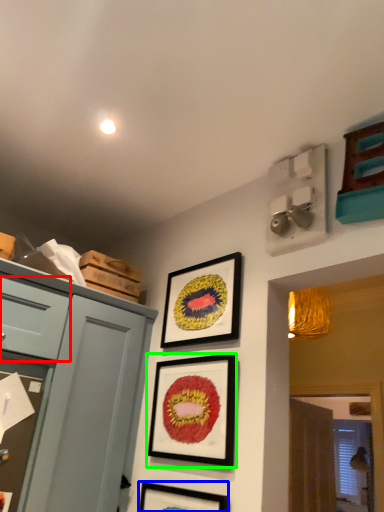
Question: Which object is positioned closest to drawer (highlighted by a red box)? Select from picture frame (highlighted by a blue box) and picture frame (highlighted by a green box).

Choices:
 (A) picture frame
 (B) picture frame

Answer: (B)